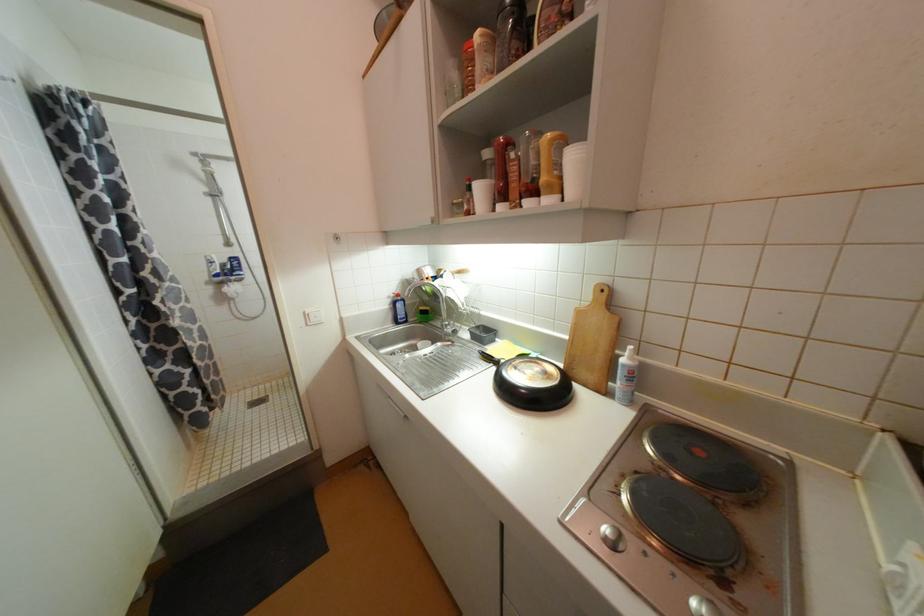
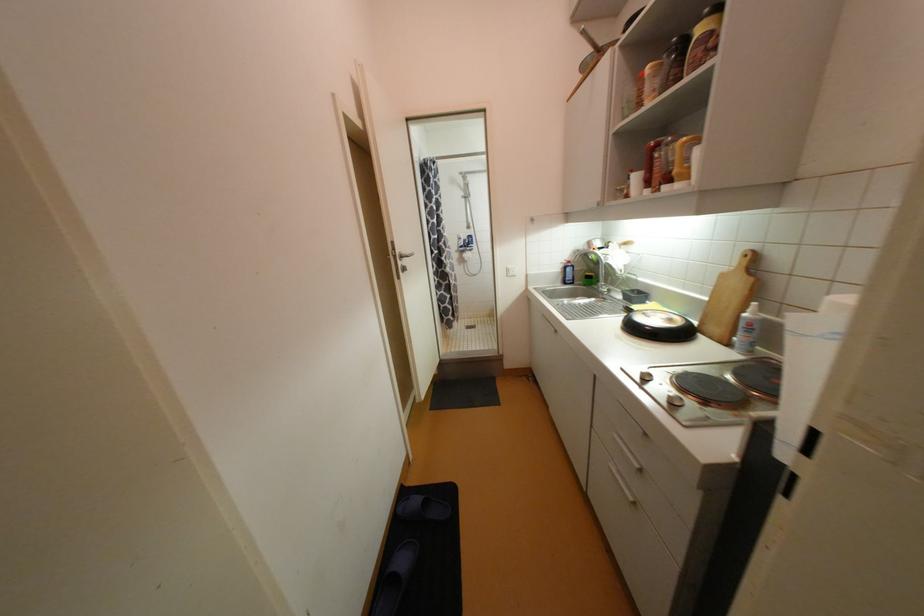
The point at (481,349) is marked in the first image. Where is the corresponding point in the second image?

(628, 305)